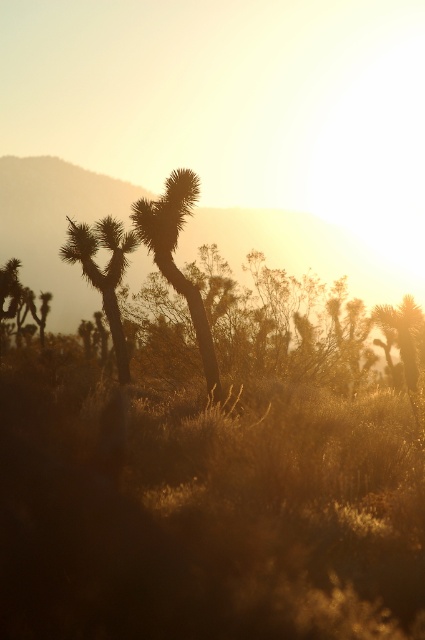
You are a desert explorer who wants to take a photo of both the brown spiky cactus at center and the silhouetted spiky cactus at center. Which one will appear taller in the photo?

The silhouetted spiky cactus at center will appear taller in the photo because it is taller than the brown spiky cactus at center.

Based on the photo, you are a desert explorer who needs to place a 3.5 meter long ladder between the brown spiky cactus at center and the silhouetted spiky cactus at center. Can the ladder fit between them without bending?

The distance between the brown spiky cactus at center and the silhouetted spiky cactus at center is 3.66 meters, so the 3.5 meter ladder can fit between them without bending since it is shorter than the distance between the two cacti.